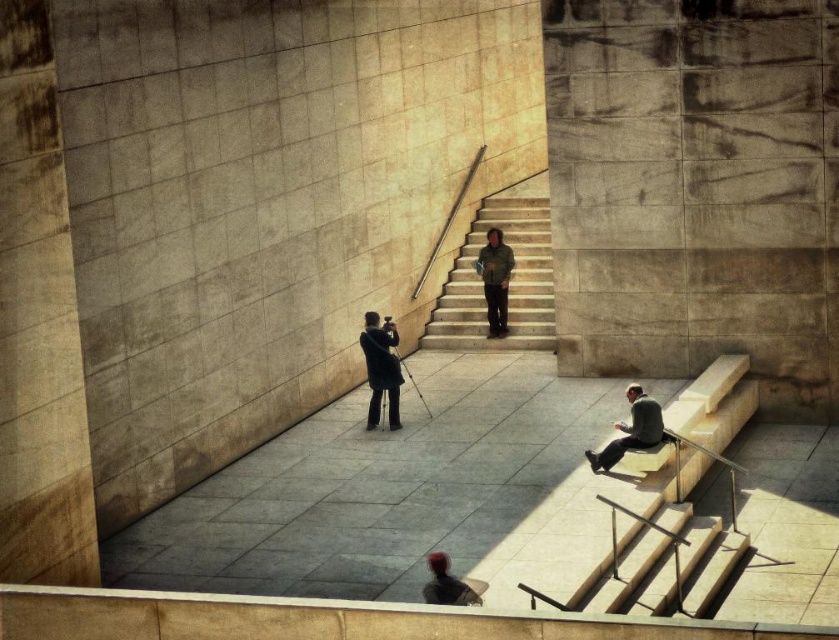
You are standing at the top of the stairs in the courtyard. You need to locate the dark gray suit at lower right. According to the coordinates provided, where should you look relative to your position?

The dark gray suit at lower right is located at point (631, 429), which is to the lower right relative to your position at the top of the stairs.

You are standing in the courtyard and want to move towards the two points marked in the scene. Which point, point (373, 419) or point (490, 280), is closer to you?

Point (373, 419) is closer to the viewer than point (490, 280), so you should move towards point (373, 419) first.

You are a photographer trying to capture a wide shot of the scene. The dark gray suit at lower right and the shiny black hair at lower center are both in your frame. Which object occupies more horizontal space in the photo?

The dark gray suit at lower right occupies more horizontal space in the photo because its width surpasses that of the shiny black hair at lower center.